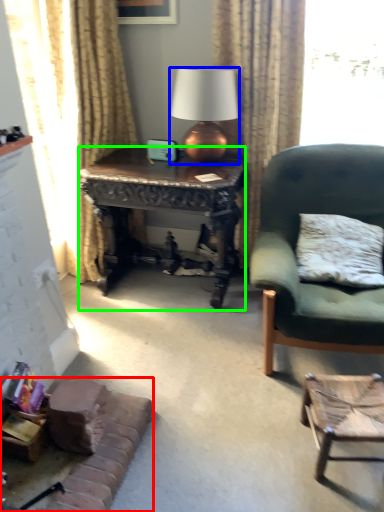
Question: Which object is positioned closest to couch (highlighted by a red box)? Select from lamp (highlighted by a blue box) and desk (highlighted by a green box).

Choices:
 (A) lamp
 (B) desk

Answer: (B)